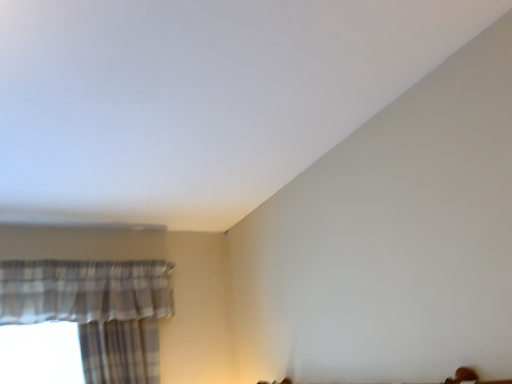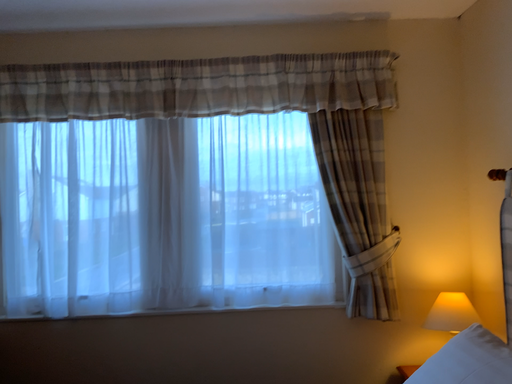
Question: Which way did the camera rotate in the video?

Choices:
 (A) rotated left
 (B) rotated right

Answer: (A)